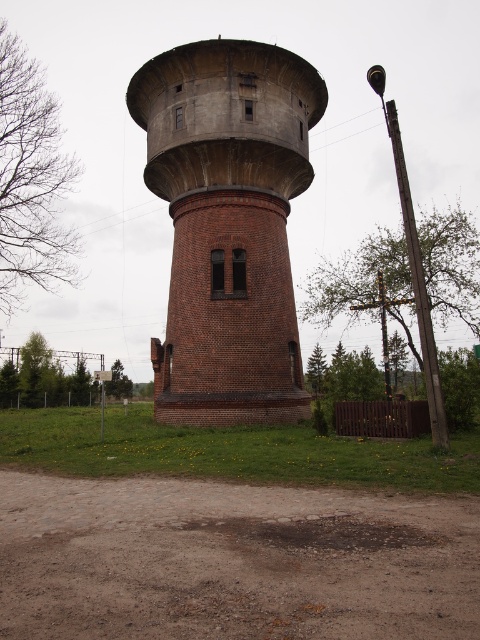
Question: Is brown gravel dirt at center positioned behind brick textured tower at center?

Choices:
 (A) no
 (B) yes

Answer: (A)

Question: Does brown gravel dirt at center have a larger size compared to brick textured tower at center?

Choices:
 (A) no
 (B) yes

Answer: (A)

Question: Can you confirm if brown gravel dirt at center is positioned below brick textured tower at center?

Choices:
 (A) yes
 (B) no

Answer: (A)

Question: Which object appears closest to the camera in this image?

Choices:
 (A) brick textured tower at center
 (B) brown gravel dirt at center

Answer: (B)

Question: Which point is farther to the camera?

Choices:
 (A) brick textured tower at center
 (B) brown gravel dirt at center

Answer: (A)